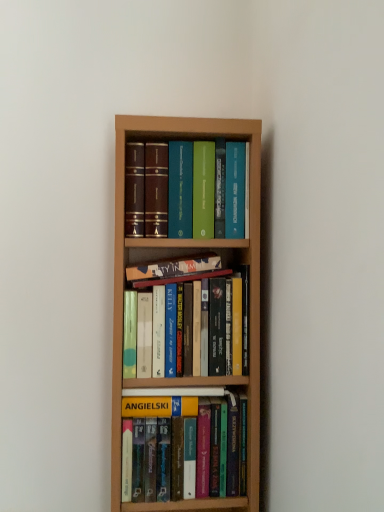
You are a GUI agent. You are given a task and a screenshot of the screen. Output one action in this format:
    pyautogui.click(x=<x>, y=<y>)
    Task: Click on the hardcover book at center, which ranks as the 4th book in top-to-bottom order
    This screenshot has width=384, height=512.
    Given the screenshot: What is the action you would take?
    pyautogui.click(x=180, y=452)

What do you see at coordinates (176, 271) in the screenshot? The width and height of the screenshot is (384, 512). I see `hardcover books at center, arranged as the 2th book when ordered from the bottom` at bounding box center [176, 271].

Find the location of a particular element. This screenshot has width=384, height=512. hardcover book at center, the second book in the top-to-bottom sequence is located at coordinates (174, 268).

Considering the relative sizes of hardcover books at center, the third book in the top-to-bottom sequence, and hardcover book at center, the second book in the top-to-bottom sequence, in the image provided, is hardcover books at center, the third book in the top-to-bottom sequence, smaller than hardcover book at center, the second book in the top-to-bottom sequence,?

No, hardcover books at center, the third book in the top-to-bottom sequence, is not smaller than hardcover book at center, the second book in the top-to-bottom sequence.

Where is `book to the left of hardcover books at center, the third book in the top-to-bottom sequence`? book to the left of hardcover books at center, the third book in the top-to-bottom sequence is located at coordinates (174, 268).

In terms of height, does hardcover books at center, arranged as the 2th book when ordered from the bottom, look taller or shorter compared to hardcover book at center, arranged as the third book when ordered from the bottom?

Clearly, hardcover books at center, arranged as the 2th book when ordered from the bottom, is taller compared to hardcover book at center, arranged as the third book when ordered from the bottom.

Based on the photo, can you tell me how much hardcover books at center, arranged as the 2th book when ordered from the bottom, and hardcover book at center, arranged as the third book when ordered from the bottom, differ in facing direction?

There is a 2.7-degree angle between the facing directions of hardcover books at center, arranged as the 2th book when ordered from the bottom, and hardcover book at center, arranged as the third book when ordered from the bottom.

Who is shorter, hardcover books at center, the third book in the top-to-bottom sequence, or hardcover book at center, the 1th book from the bottom?

With less height is hardcover book at center, the 1th book from the bottom.

Is hardcover books at center, the third book in the top-to-bottom sequence, bigger or smaller than hardcover book at center, the 1th book from the bottom?

hardcover books at center, the third book in the top-to-bottom sequence, is bigger than hardcover book at center, the 1th book from the bottom.

Does hardcover books at center, arranged as the 2th book when ordered from the bottom, touch hardcover book at center, which ranks as the 4th book in top-to-bottom order?

hardcover books at center, arranged as the 2th book when ordered from the bottom, and hardcover book at center, which ranks as the 4th book in top-to-bottom order, are clearly separated.

Considering the positions of objects hardcover books at center, arranged as the 2th book when ordered from the bottom, and hardcover book at center, the 1th book from the bottom, in the image provided, who is more to the right, hardcover books at center, arranged as the 2th book when ordered from the bottom, or hardcover book at center, the 1th book from the bottom,?

From the viewer's perspective, hardcover book at center, the 1th book from the bottom, appears more on the right side.

Considering the relative positions of hardcover books at center, acting as the 1th book starting from the top, and hardcover book at center, the second book in the top-to-bottom sequence, in the image provided, is hardcover books at center, acting as the 1th book starting from the top, to the left of hardcover book at center, the second book in the top-to-bottom sequence, from the viewer's perspective?

In fact, hardcover books at center, acting as the 1th book starting from the top, is to the right of hardcover book at center, the second book in the top-to-bottom sequence.

Would you consider hardcover books at center, which is the fourth book in bottom-to-top order, to be distant from hardcover book at center, the second book in the top-to-bottom sequence?

No.

Can you confirm if hardcover books at center, which is the fourth book in bottom-to-top order, is taller than hardcover book at center, arranged as the third book when ordered from the bottom?

Yes.

Measure the distance from hardcover books at center, which is the fourth book in bottom-to-top order, to hardcover book at center, the second book in the top-to-bottom sequence.

hardcover books at center, which is the fourth book in bottom-to-top order, and hardcover book at center, the second book in the top-to-bottom sequence, are 5.52 inches apart.

Could you tell me if hardcover book at center, which ranks as the 4th book in top-to-bottom order, is facing hardcover books at center, arranged as the 2th book when ordered from the bottom?

No.

This screenshot has width=384, height=512. I want to click on the 1st book behind the hardcover books at center, the third book in the top-to-bottom sequence, so click(x=180, y=452).

Considering the points (164, 483) and (174, 337), which point is behind, point (164, 483) or point (174, 337)?

Positioned behind is point (174, 337).

Is the surface of hardcover book at center, the second book in the top-to-bottom sequence, in direct contact with hardcover books at center, acting as the 1th book starting from the top?

hardcover book at center, the second book in the top-to-bottom sequence, and hardcover books at center, acting as the 1th book starting from the top, are clearly separated.

Is hardcover books at center, acting as the 1th book starting from the top, at the back of hardcover book at center, the second book in the top-to-bottom sequence?

No.

Who is taller, hardcover book at center, the second book in the top-to-bottom sequence, or hardcover books at center, which is the fourth book in bottom-to-top order?

hardcover books at center, which is the fourth book in bottom-to-top order.

Locate an element on the screen. book located above the hardcover book at center, arranged as the third book when ordered from the bottom (from a real-world perspective) is located at coordinates (188, 190).

Is hardcover book at center, arranged as the third book when ordered from the bottom, not within hardcover book at center, which ranks as the 4th book in top-to-bottom order?

That's correct, hardcover book at center, arranged as the third book when ordered from the bottom, is outside of hardcover book at center, which ranks as the 4th book in top-to-bottom order.

Which of these two, hardcover book at center, the second book in the top-to-bottom sequence, or hardcover book at center, the 1th book from the bottom, stands taller?

hardcover book at center, the 1th book from the bottom.

In the scene shown: Could you tell me if hardcover book at center, arranged as the third book when ordered from the bottom, is facing hardcover book at center, the 1th book from the bottom?

No, hardcover book at center, arranged as the third book when ordered from the bottom, is not oriented towards hardcover book at center, the 1th book from the bottom.

Which object is wider, hardcover book at center, the second book in the top-to-bottom sequence, or hardcover book at center, the 1th book from the bottom?

With larger width is hardcover book at center, the 1th book from the bottom.

From a real-world perspective, does hardcover books at center, acting as the 1th book starting from the top, sit lower than hardcover book at center, the 1th book from the bottom?

No.

Is hardcover books at center, which is the fourth book in bottom-to-top order, outside of hardcover book at center, the 1th book from the bottom?

hardcover books at center, which is the fourth book in bottom-to-top order, is positioned outside hardcover book at center, the 1th book from the bottom.

From the image's perspective, is hardcover books at center, which is the fourth book in bottom-to-top order, located beneath hardcover book at center, which ranks as the 4th book in top-to-bottom order?

No, from the image's perspective, hardcover books at center, which is the fourth book in bottom-to-top order, is not below hardcover book at center, which ranks as the 4th book in top-to-bottom order.

From the image's perspective, count 1st books downward from the hardcover book at center, arranged as the third book when ordered from the bottom, and point to it. Please provide its 2D coordinates.

[(176, 271)]

The height and width of the screenshot is (512, 384). What are the coordinates of `book that is the 1st object located above the hardcover book at center, the 1th book from the bottom (from the image's perspective)` in the screenshot? It's located at (176, 271).

When comparing their distances from hardcover books at center, the third book in the top-to-bottom sequence, does hardcover books at center, which is the fourth book in bottom-to-top order, or hardcover book at center, which ranks as the 4th book in top-to-bottom order, seem further?

hardcover book at center, which ranks as the 4th book in top-to-bottom order, is further to hardcover books at center, the third book in the top-to-bottom sequence.

Estimate the real-world distances between objects in this image. Which object is closer to hardcover books at center, which is the fourth book in bottom-to-top order, hardcover book at center, arranged as the third book when ordered from the bottom, or hardcover book at center, the 1th book from the bottom?

Based on the image, hardcover book at center, arranged as the third book when ordered from the bottom, appears to be nearer to hardcover books at center, which is the fourth book in bottom-to-top order.

From the image, which object appears to be nearer to hardcover book at center, the 1th book from the bottom, hardcover books at center, the third book in the top-to-bottom sequence, or hardcover book at center, the second book in the top-to-bottom sequence?

hardcover books at center, the third book in the top-to-bottom sequence.

When comparing their distances from hardcover book at center, which ranks as the 4th book in top-to-bottom order, does hardcover books at center, which is the fourth book in bottom-to-top order, or hardcover book at center, arranged as the third book when ordered from the bottom, seem further?

hardcover books at center, which is the fourth book in bottom-to-top order, is further to hardcover book at center, which ranks as the 4th book in top-to-bottom order.

Estimate the real-world distances between objects in this image. Which object is closer to hardcover book at center, the 1th book from the bottom, hardcover books at center, the third book in the top-to-bottom sequence, or hardcover books at center, acting as the 1th book starting from the top?

hardcover books at center, the third book in the top-to-bottom sequence, is positioned closer to the anchor hardcover book at center, the 1th book from the bottom.

Considering their positions, is hardcover book at center, which ranks as the 4th book in top-to-bottom order, positioned closer to hardcover books at center, which is the fourth book in bottom-to-top order, than hardcover book at center, arranged as the third book when ordered from the bottom?

Based on the image, hardcover book at center, arranged as the third book when ordered from the bottom, appears to be nearer to hardcover books at center, which is the fourth book in bottom-to-top order.

Looking at this image, when comparing their distances from hardcover book at center, the second book in the top-to-bottom sequence, does hardcover books at center, acting as the 1th book starting from the top, or hardcover books at center, the third book in the top-to-bottom sequence, seem closer?

hardcover books at center, the third book in the top-to-bottom sequence, is closer to hardcover book at center, the second book in the top-to-bottom sequence.

Which object lies further to the anchor point hardcover books at center, which is the fourth book in bottom-to-top order, hardcover books at center, the third book in the top-to-bottom sequence, or hardcover book at center, arranged as the third book when ordered from the bottom?

Based on the image, hardcover books at center, the third book in the top-to-bottom sequence, appears to be further to hardcover books at center, which is the fourth book in bottom-to-top order.

Find the location of a particular element. The height and width of the screenshot is (512, 384). book that lies between hardcover books at center, which is the fourth book in bottom-to-top order, and hardcover books at center, the third book in the top-to-bottom sequence, from top to bottom is located at coordinates (174, 268).

The height and width of the screenshot is (512, 384). Identify the location of book between hardcover book at center, arranged as the third book when ordered from the bottom, and hardcover book at center, which ranks as the 4th book in top-to-bottom order, from top to bottom. (176, 271).